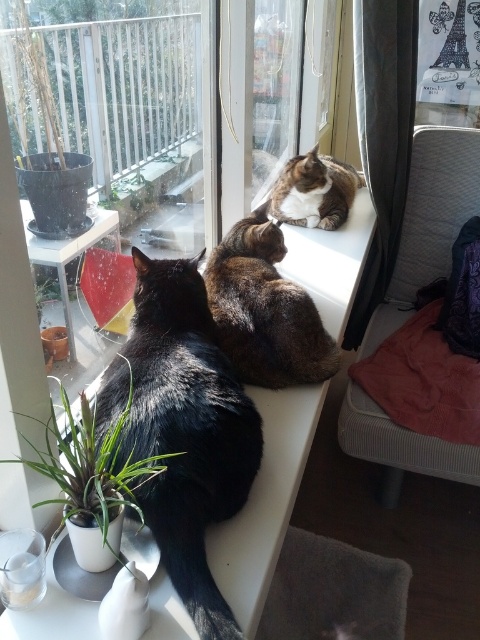
Question: Is brown fur cat at center further to camera compared to green leafy plant at upper left?

Choices:
 (A) no
 (B) yes

Answer: (A)

Question: Can you confirm if black fur cat at left is thinner than brown fur cat at center?

Choices:
 (A) yes
 (B) no

Answer: (A)

Question: Estimate the real-world distances between objects in this image. Which object is farther from the brown fur cat at center?

Choices:
 (A) tabby fur cat at upper center
 (B) green leafy plant at lower left
 (C) green leafy plant at upper left
 (D) black fur cat at left

Answer: (A)

Question: Among these points, which one is farthest from the camera?

Choices:
 (A) (204, 356)
 (B) (141, 173)
 (C) (254, 316)
 (D) (60, 460)

Answer: (B)

Question: Can you confirm if black fur cat at left is positioned below tabby fur cat at upper center?

Choices:
 (A) yes
 (B) no

Answer: (A)

Question: Which of the following is the farthest from the observer?

Choices:
 (A) tabby fur cat at upper center
 (B) green leafy plant at lower left
 (C) brown fur cat at center
 (D) black fur cat at left

Answer: (A)